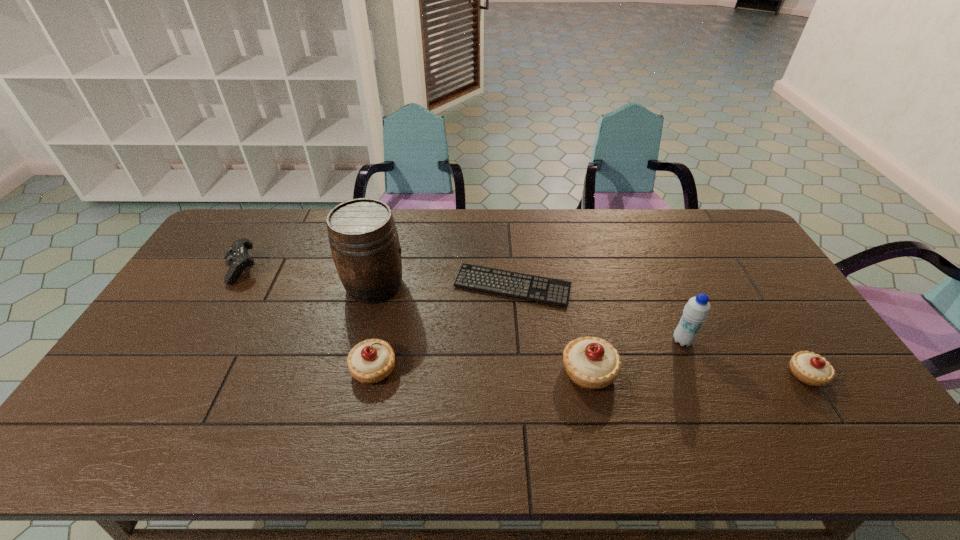
This screenshot has width=960, height=540. In order to click on the fourth shortest object in this screenshot , I will do `click(370, 361)`.

The image size is (960, 540). Find the location of `the leftmost pastry`. the leftmost pastry is located at coordinates (370, 361).

Where is `the tallest pastry`? The image size is (960, 540). the tallest pastry is located at coordinates (593, 363).

The image size is (960, 540). Identify the location of the second pastry from left to right. coord(593,363).

At what (x,y) coordinates should I click in order to perform the action: click on the rightmost object. Please return your answer as a coordinate pair (x, y). This screenshot has height=540, width=960. Looking at the image, I should click on (810, 368).

Identify the location of the shortest pastry. The height and width of the screenshot is (540, 960). (810, 368).

What are the coordinates of `computer keyboard` in the screenshot? It's located at (512, 284).

Identify the location of control. The height and width of the screenshot is (540, 960). (237, 257).

What are the coordinates of `cider` in the screenshot? It's located at (363, 237).

Where is `the second tallest object`? This screenshot has width=960, height=540. the second tallest object is located at coordinates click(x=696, y=311).